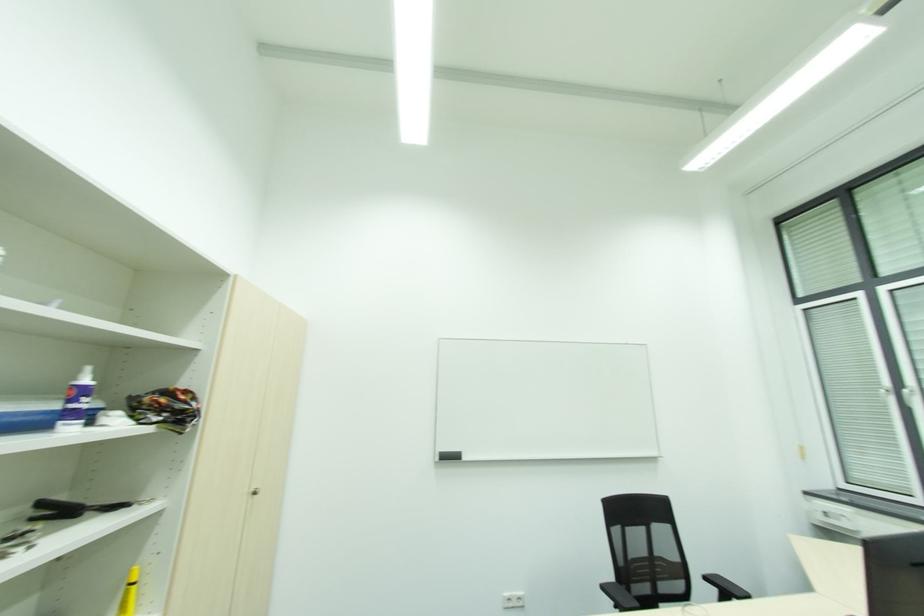
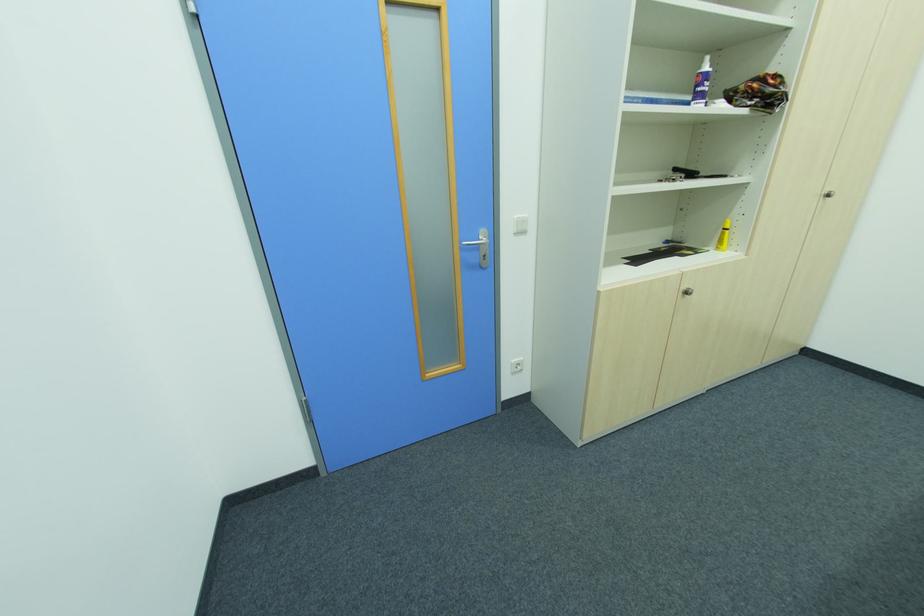
Find the pixel in the second image that matches (x=138, y=584) in the first image.

(728, 230)